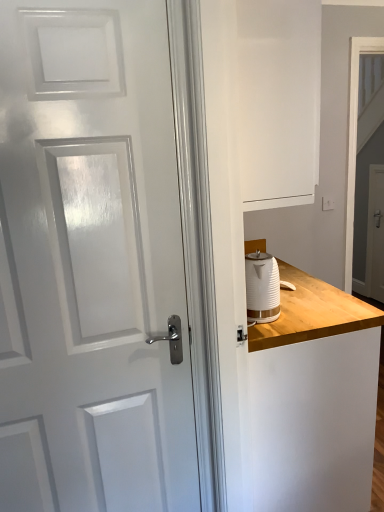
Question: In the image, is white glossy door at left on the left side or the right side of white matte dresser at right?

Choices:
 (A) right
 (B) left

Answer: (B)

Question: Considering the positions of white glossy door at left and white matte dresser at right in the image, is white glossy door at left wider or thinner than white matte dresser at right?

Choices:
 (A) wide
 (B) thin

Answer: (B)

Question: Which of these objects is positioned closest to the white glossy screen door at upper right, marked as the first screen door in a front-to-back arrangement?

Choices:
 (A) white ribbed kettle at right
 (B) white glossy screen door at right, acting as the first screen door starting from the back
 (C) wooden counter at right
 (D) white glossy door at left
 (E) white matte dresser at right

Answer: (B)

Question: Estimate the real-world distances between objects in this image. Which object is closer to the wooden counter at right?

Choices:
 (A) white ribbed kettle at right
 (B) white glossy screen door at right, which appears as the 2th screen door when viewed from the front
 (C) white glossy screen door at upper right, marked as the first screen door in a front-to-back arrangement
 (D) white glossy door at left
 (E) white matte dresser at right

Answer: (E)